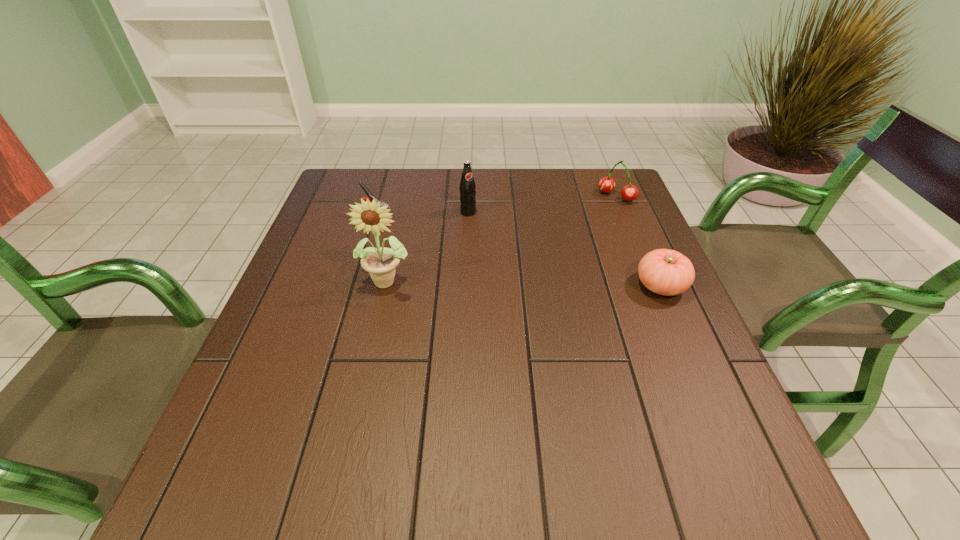
At what (x,y) coordinates should I click in order to perform the action: click on free spot on the desktop that is between the tallest object and the tomato and is positioned on the front label of the fourth shortest object. Please return your answer as a coordinate pair (x, y). The height and width of the screenshot is (540, 960). Looking at the image, I should click on click(545, 284).

You are a GUI agent. You are given a task and a screenshot of the screen. Output one action in this format:
    pyautogui.click(x=<x>, y=<y>)
    Task: Click on the free space on the desktop that is between the sunflower and the tomato and is positioned with stems pointing upwards on the farthest object
    The width and height of the screenshot is (960, 540).
    Given the screenshot: What is the action you would take?
    pyautogui.click(x=519, y=283)

Locate an element on the screen. The image size is (960, 540). vacant spot on the desktop that is between the sunflower and the tomato and is positioned on the handle side of the stapler is located at coordinates (504, 282).